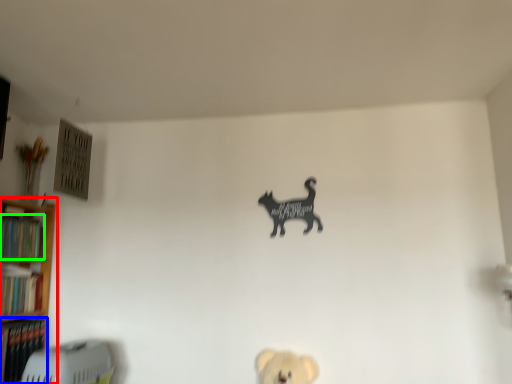
Question: Which is farther away from shelf (highlighted by a red box)? book (highlighted by a blue box) or book (highlighted by a green box)?

Choices:
 (A) book
 (B) book

Answer: (A)